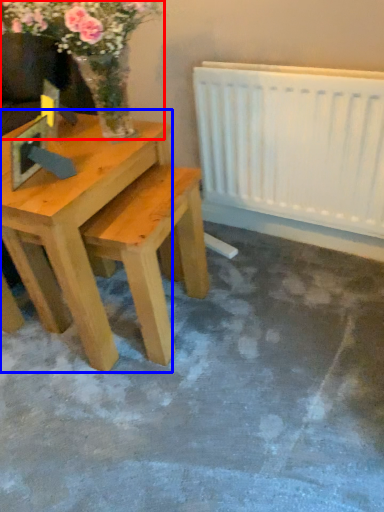
Question: Which object is closer to the camera taking this photo, floral arrangement (highlighted by a red box) or table (highlighted by a blue box)?

Choices:
 (A) floral arrangement
 (B) table

Answer: (A)